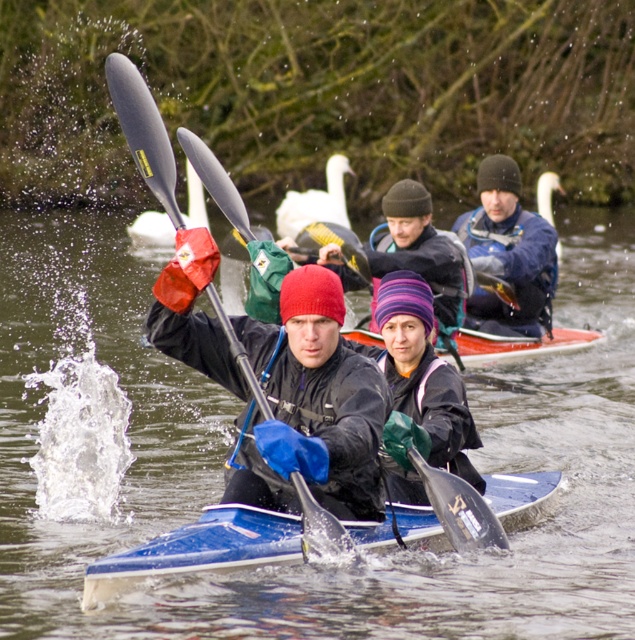
You are a photographer trying to capture the blue plastic canoe at center and the purple striped knit hat at center in the same frame. Which object should you focus on to ensure both are in focus?

The blue plastic canoe at center has a lesser height compared to purple striped knit hat at center, so focusing on the blue plastic canoe at center would ensure both are in focus since it is closer to the camera.

You are a photographer trying to capture the purple striped knit hat at center in your shot. According to the coordinates provided, where should you aim your camera?

You should aim your camera at point (x=418, y=388) to capture the purple striped knit hat at center.

You are a photographer trying to focus on two specific points in the image. The first point is at coordinates point (413, 276) and the second is at point (323, 189). Given that you want to focus on the closer point to ensure sharpness, which point should you choose?

Point (413, 276) is closer to the camera than point (323, 189), so you should focus on point (413, 276) to ensure sharpness.